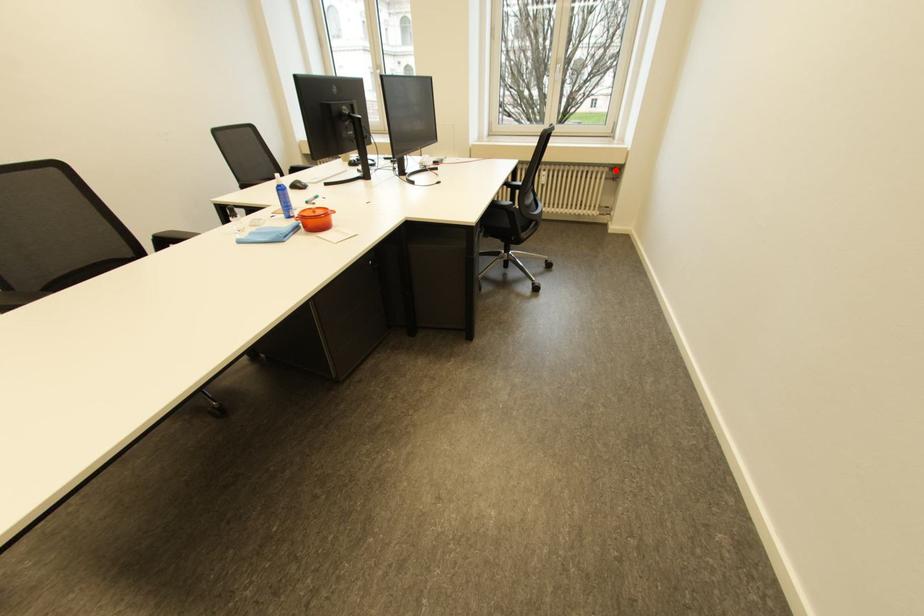
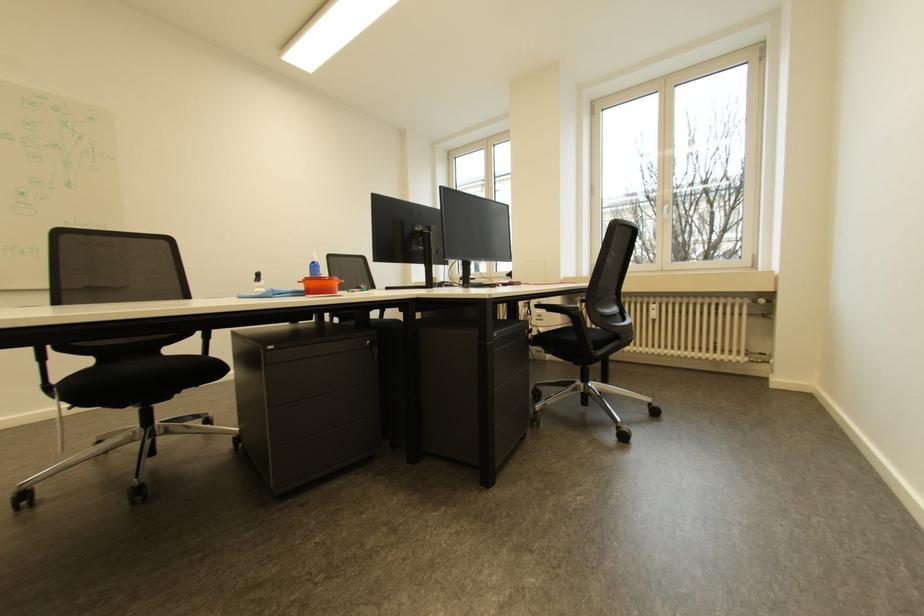
Question: I am providing you with two images of the same scene from different viewpoints. Given a red point in image1, look at the same physical point in image2. Is it:

Choices:
 (A) Closer to the viewpoint
 (B) Farther from the viewpoint

Answer: (B)